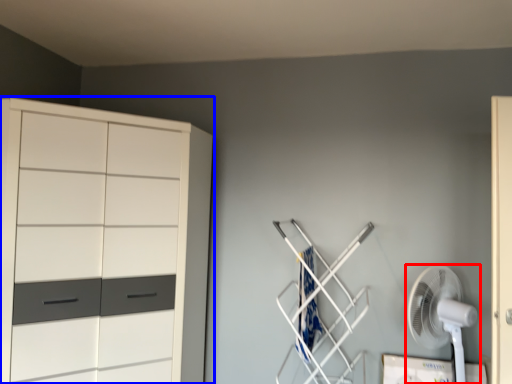
Question: Which of the following is the closest to the observer, mechanical fan (highlighted by a red box) or cupboard (highlighted by a blue box)?

Choices:
 (A) mechanical fan
 (B) cupboard

Answer: (B)